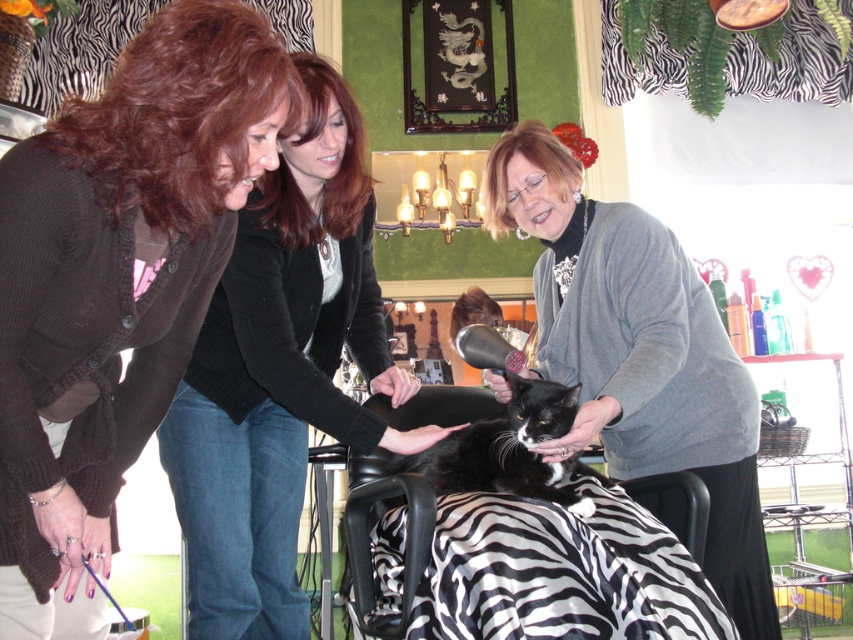
Question: Among these points, which one is nearest to the camera?

Choices:
 (A) (460, 595)
 (B) (323, 198)

Answer: (A)

Question: Which object appears closest to the camera in this image?

Choices:
 (A) matte brown sweater at center
 (B) gray sweater at center

Answer: (A)

Question: Does gray sweater at center appear under brown wavy hair at upper left?

Choices:
 (A) no
 (B) yes

Answer: (B)

Question: Is gray sweater at center positioned before brown smooth hair at center?

Choices:
 (A) no
 (B) yes

Answer: (A)

Question: Is brown smooth hair at center in front of gray/glassy hair at upper center?

Choices:
 (A) yes
 (B) no

Answer: (A)

Question: Which object is the farthest from the gray/glassy hair at upper center?

Choices:
 (A) brown fuzzy hair at upper center
 (B) zebra-patterned fabric at center
 (C) gray sweater at center
 (D) brown wavy hair at upper left

Answer: (A)